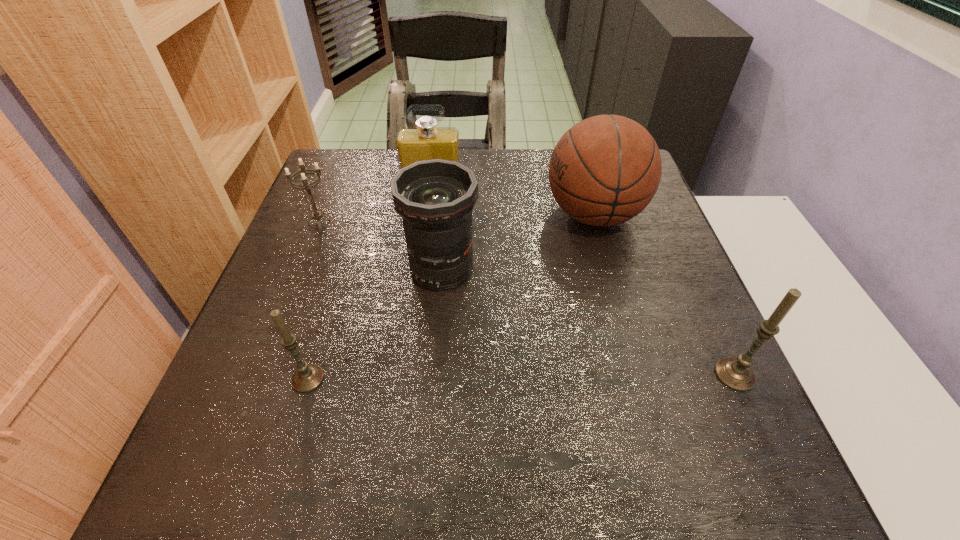
Locate an element on the screen. free point located on the left of the rightmost object is located at coordinates (542, 375).

At what (x,y) coordinates should I click in order to perform the action: click on blank space located on the side with brand label of the second object from right to left. Please return your answer as a coordinate pair (x, y). The height and width of the screenshot is (540, 960). Looking at the image, I should click on (417, 215).

What are the coordinates of `vacant space located on the side with brand label of the second object from right to left` in the screenshot? It's located at (393, 215).

Find the location of a particular element. This screenshot has width=960, height=540. free point located 0.300m on the side with brand label of the second object from right to left is located at coordinates (424, 215).

Image resolution: width=960 pixels, height=540 pixels. What are the coordinates of `vacant region located 0.150m on the front-facing side of the perfume` in the screenshot? It's located at (427, 233).

At what (x,y) coordinates should I click in order to perform the action: click on free space located on the front of the leftmost object. Please return your answer as a coordinate pair (x, y). Looking at the image, I should click on (263, 363).

You are a GUI agent. You are given a task and a screenshot of the screen. Output one action in this format:
    pyautogui.click(x=<x>, y=<y>)
    Task: Click on the free point located 0.260m on the back of the telephoto lens
    The image size is (960, 540).
    Given the screenshot: What is the action you would take?
    pyautogui.click(x=449, y=181)

The height and width of the screenshot is (540, 960). Find the location of `basketball located in the far edge section of the desktop`. basketball located in the far edge section of the desktop is located at coordinates (606, 169).

Identify the location of perfume located in the far edge section of the desktop. The width and height of the screenshot is (960, 540). (426, 141).

Find the location of a particular element. candle positioned at the left edge is located at coordinates (307, 377).